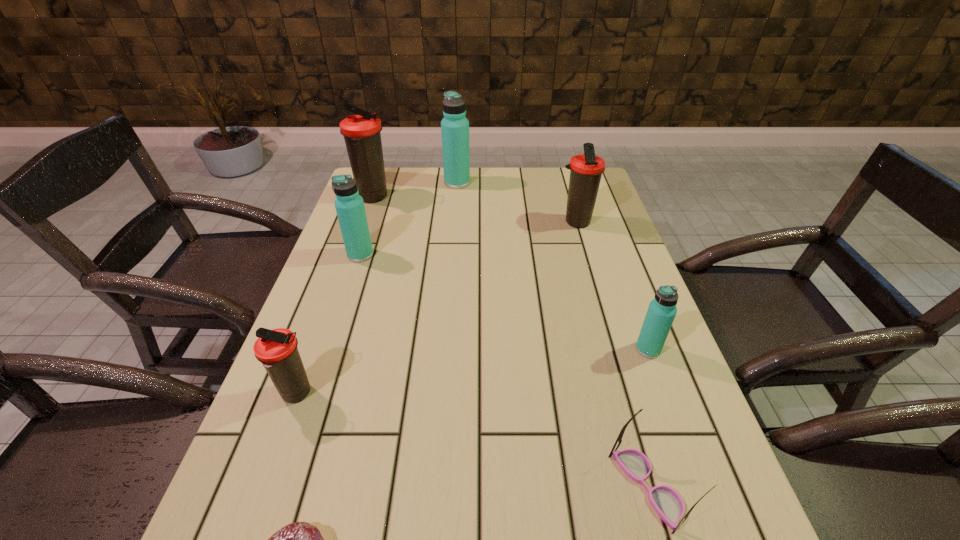
The image size is (960, 540). Identify the location of vacant space that is in between the rightmost brown thermos bottle and the fifth object from left to right. (516, 202).

Locate an element on the screen. This screenshot has width=960, height=540. blank region between the farthest aqua thermos bottle and the rightmost aqua thermos bottle is located at coordinates (553, 266).

Identify which object is the closest to the second nearest thermos bottle. Please provide its 2D coordinates. Your answer should be formatted as a tuple, i.e. [(x, y)], where the tuple contains the x and y coordinates of a point satisfying the conditions above.

[(668, 504)]

Where is `object that is the closest to the farthest aqua thermos bottle`? The image size is (960, 540). object that is the closest to the farthest aqua thermos bottle is located at coordinates (362, 133).

Identify the location of thermos bottle that stands as the closest to the nearest brown thermos bottle. This screenshot has width=960, height=540. (350, 209).

Locate which thermos bottle is the closest to the smallest aqua thermos bottle. Please provide its 2D coordinates. Your answer should be formatted as a tuple, i.e. [(x, y)], where the tuple contains the x and y coordinates of a point satisfying the conditions above.

[(586, 169)]

Identify the location of brown thermos bottle that is the third closest one to the leftmost aqua thermos bottle. (586, 169).

Locate an element on the screen. brown thermos bottle that is the third closest to the shortest object is located at coordinates (362, 133).

Identify which aqua thermos bottle is the closest to the third nearest object. Please provide its 2D coordinates. Your answer should be formatted as a tuple, i.e. [(x, y)], where the tuple contains the x and y coordinates of a point satisfying the conditions above.

[(350, 209)]

Find the location of a particular element. This screenshot has height=540, width=960. the third closest aqua thermos bottle relative to the nearest brown thermos bottle is located at coordinates (454, 126).